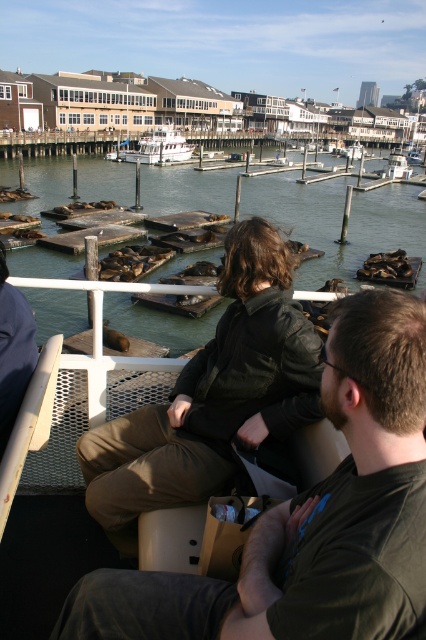
Can you confirm if greenish water at center is taller than white matte boat at center?

Yes.

Which is in front, point (354, 266) or point (138, 154)?

Point (354, 266)

Find the location of a particular element. The height and width of the screenshot is (640, 426). greenish water at center is located at coordinates (339, 221).

Based on the photo, does white matte boat at center appear under white glossy boat at center?

Indeed, white matte boat at center is positioned under white glossy boat at center.

Can you confirm if white matte boat at center is bigger than white glossy boat at center?

No.

What do you see at coordinates (160, 147) in the screenshot? I see `white matte boat at center` at bounding box center [160, 147].

Locate an element on the screen. The image size is (426, 640). white matte boat at center is located at coordinates (160, 147).

Which of these two, dark brown leather jacket at center or leather jacket at center, stands shorter?

Standing shorter between the two is dark brown leather jacket at center.

Is dark brown leather jacket at center to the left of leather jacket at center from the viewer's perspective?

No, dark brown leather jacket at center is not to the left of leather jacket at center.

Locate an element on the screen. dark brown leather jacket at center is located at coordinates (310, 516).